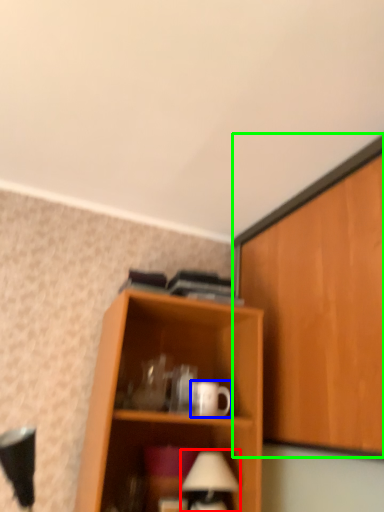
Question: Which is farther away from table lamp (highlighted by a red box)? mug (highlighted by a blue box) or cabinetry (highlighted by a green box)?

Choices:
 (A) mug
 (B) cabinetry

Answer: (B)